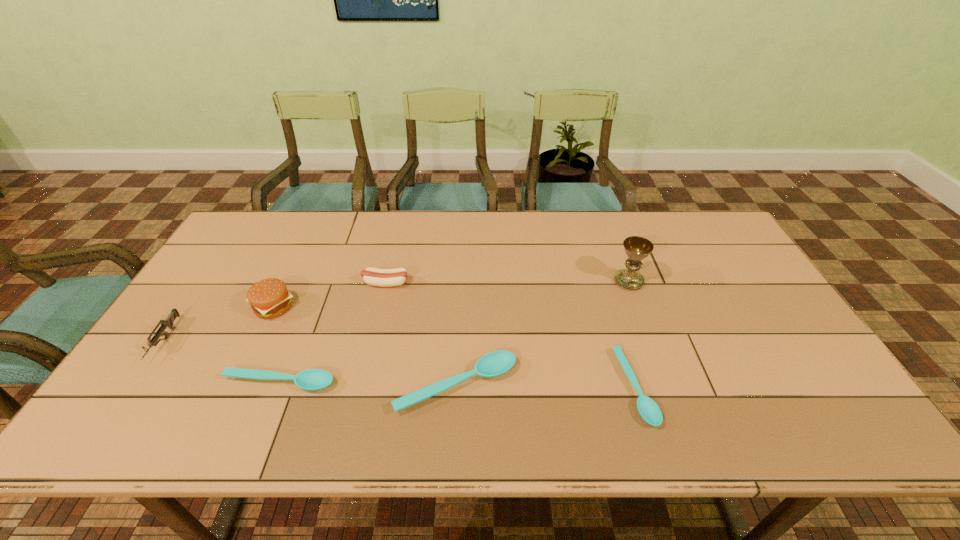
Find the location of a particular element. vacant space at the left edge of the desktop is located at coordinates (208, 322).

Identify the location of blank space at the right edge. (753, 353).

The image size is (960, 540). In the image, there is a desktop. Find the location of `vacant space at the far left corner`. vacant space at the far left corner is located at coordinates (268, 238).

In the image, there is a desktop. Find the location of `vacant area at the far right corner`. vacant area at the far right corner is located at coordinates (729, 243).

Find the location of `free spot at the near right corner of the desktop`. free spot at the near right corner of the desktop is located at coordinates (838, 396).

Where is `unoccupied area between the hamburger and the leftmost object`? This screenshot has height=540, width=960. unoccupied area between the hamburger and the leftmost object is located at coordinates (219, 324).

What are the coordinates of `vacant region between the third object from right to left and the chalice` in the screenshot? It's located at (542, 333).

You are a GUI agent. You are given a task and a screenshot of the screen. Output one action in this format:
    pyautogui.click(x=<x>, y=<y>)
    Task: Click on the vacant area between the sixth tallest object and the second spoon from right to left
    
    Given the screenshot: What is the action you would take?
    pyautogui.click(x=368, y=384)

This screenshot has height=540, width=960. I want to click on free space between the sausage and the rightmost spoon, so click(x=510, y=335).

What are the coordinates of `blank region between the sixth tallest object and the second spoon from right to left` in the screenshot? It's located at (368, 384).